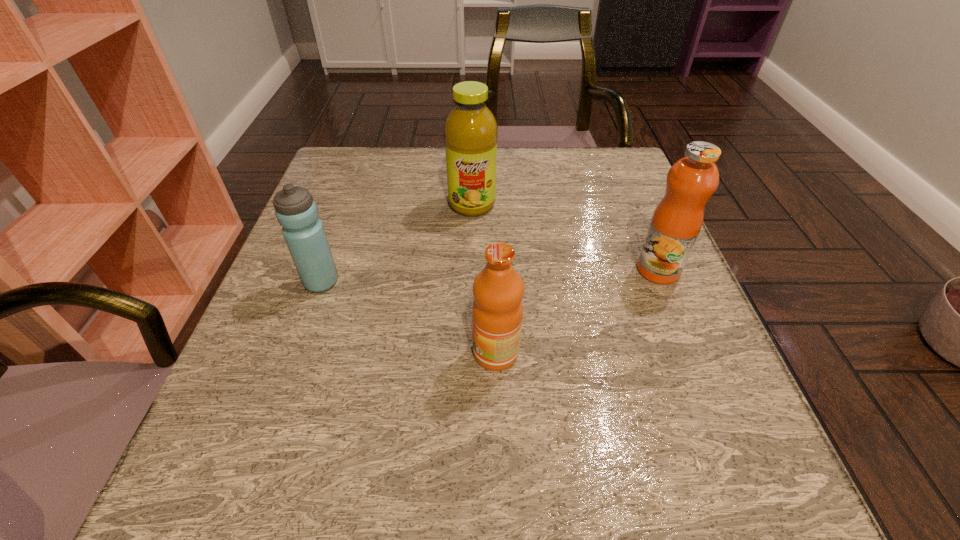
Find the location of a particular element. This screenshot has width=960, height=540. vacant space that satisfies the following two spatial constraints: 1. on the front label of the farthest object; 2. on the left side of the rightmost fruit juice is located at coordinates (470, 270).

I want to click on vacant area that satisfies the following two spatial constraints: 1. on the front label of the rightmost object; 2. on the left side of the farthest object, so click(470, 270).

This screenshot has height=540, width=960. Identify the location of free space that satisfies the following two spatial constraints: 1. on the front side of the rightmost fruit juice; 2. on the label side of the nearest object. (692, 353).

Locate an element on the screen. vacant space that satisfies the following two spatial constraints: 1. on the front label of the farthest object; 2. on the left side of the rightmost fruit juice is located at coordinates (470, 270).